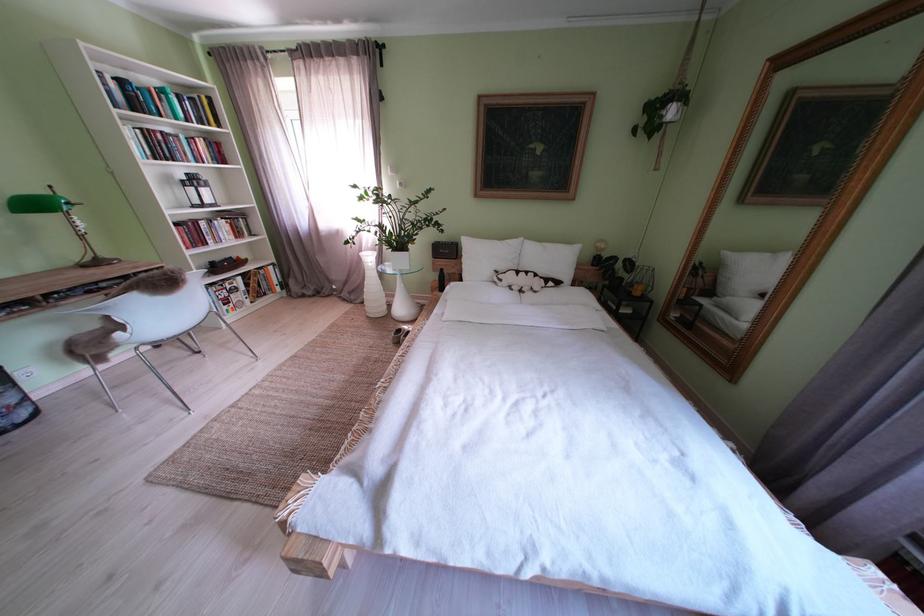
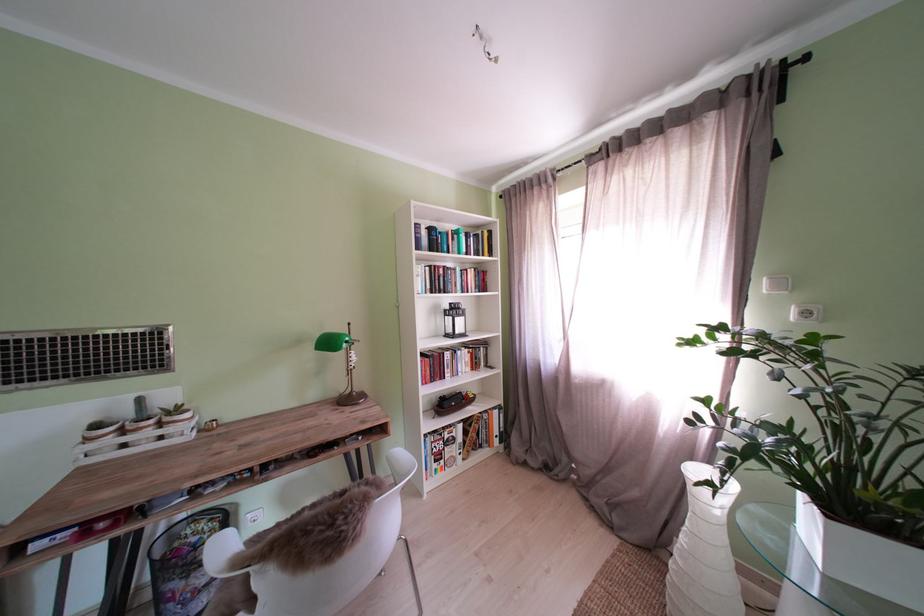
Find the pixel in the second image that matches point (253, 293) in the first image.

(470, 444)